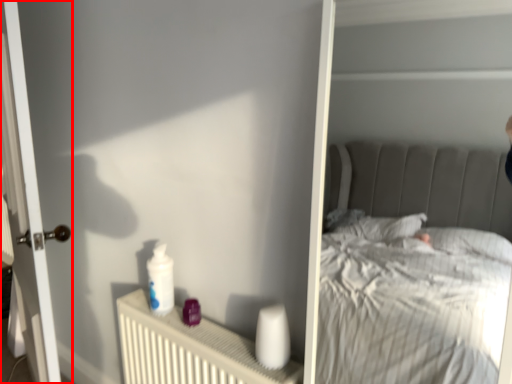
Question: Considering the relative positions of door (annotated by the red box) and radiator in the image provided, where is door (annotated by the red box) located with respect to the staircase?

Choices:
 (A) left
 (B) right

Answer: (A)